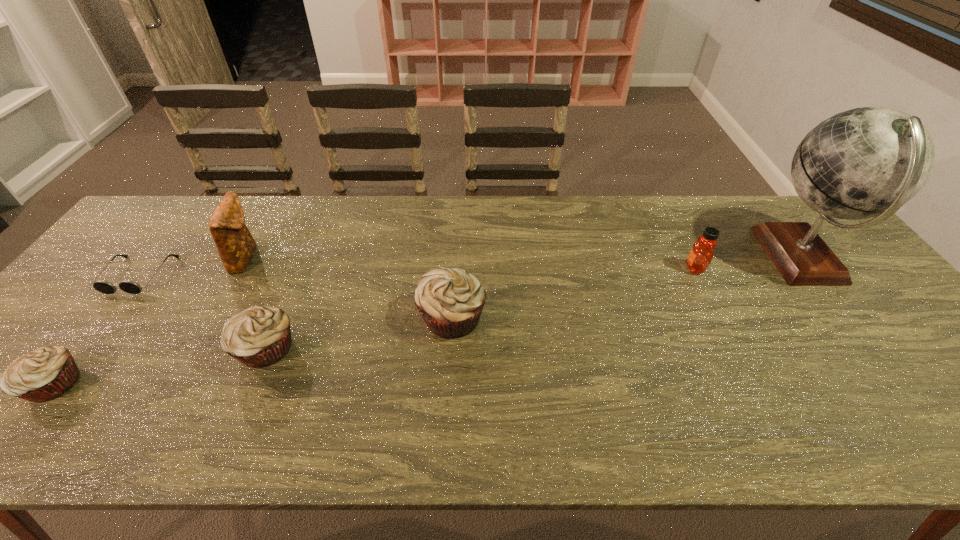
Where is `vacant space at the near edge of the desktop`? vacant space at the near edge of the desktop is located at coordinates (445, 386).

You are a GUI agent. You are given a task and a screenshot of the screen. Output one action in this format:
    pyautogui.click(x=<x>, y=<y>)
    Task: Click on the vacant space at the left edge of the desktop
    The image size is (960, 540).
    Given the screenshot: What is the action you would take?
    pyautogui.click(x=80, y=315)

The height and width of the screenshot is (540, 960). Find the location of `free region at the right edge of the desktop`. free region at the right edge of the desktop is located at coordinates (840, 292).

The image size is (960, 540). Find the location of `empty location between the sixth object from left to right and the shortest object`. empty location between the sixth object from left to right and the shortest object is located at coordinates (417, 272).

Image resolution: width=960 pixels, height=540 pixels. What are the coordinates of `unoccupied position between the second shortest object and the fifth tallest object` in the screenshot? It's located at (160, 367).

The height and width of the screenshot is (540, 960). I want to click on free space between the sunglasses and the second tallest object, so click(x=192, y=266).

Locate an element on the screen. free spot between the rightmost object and the clutch bag is located at coordinates (523, 258).

Find the location of a particular element. This screenshot has width=960, height=540. vacant point located between the shortest object and the honey is located at coordinates (417, 272).

Identify the location of free point between the globe and the rightmost muffin. (626, 287).

The width and height of the screenshot is (960, 540). In order to click on free space between the sunglasses and the second muffin from left to right in this screenshot , I will do `click(203, 312)`.